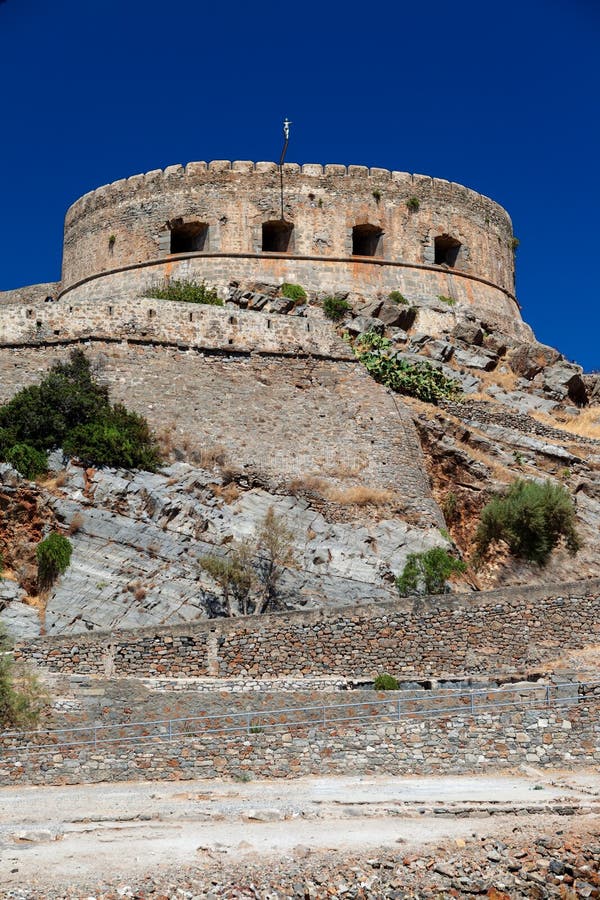
Identify the location of window. This screenshot has height=900, width=600. (183, 236).